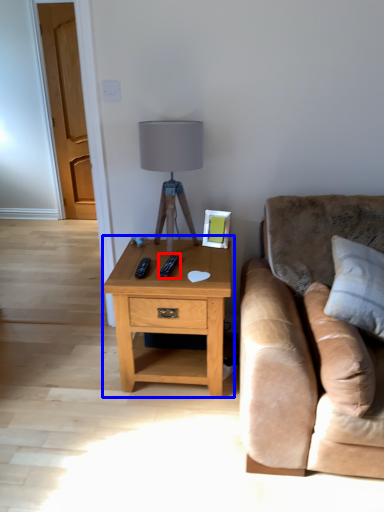
Question: Which point is further to the camera, remote (highlighted by a red box) or nightstand (highlighted by a blue box)?

Choices:
 (A) remote
 (B) nightstand

Answer: (A)